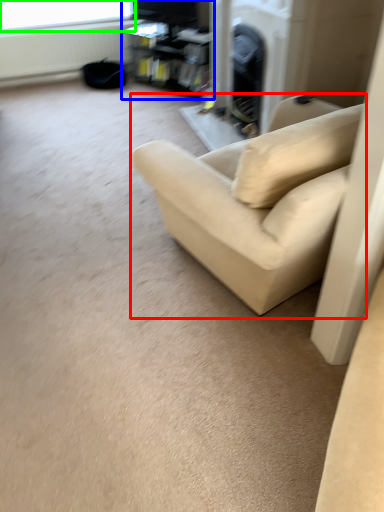
Question: Estimate the real-world distances between objects in this image. Which object is closer to studio couch (highlighted by a red box), entertainment center (highlighted by a blue box) or window screen (highlighted by a green box)?

Choices:
 (A) entertainment center
 (B) window screen

Answer: (A)